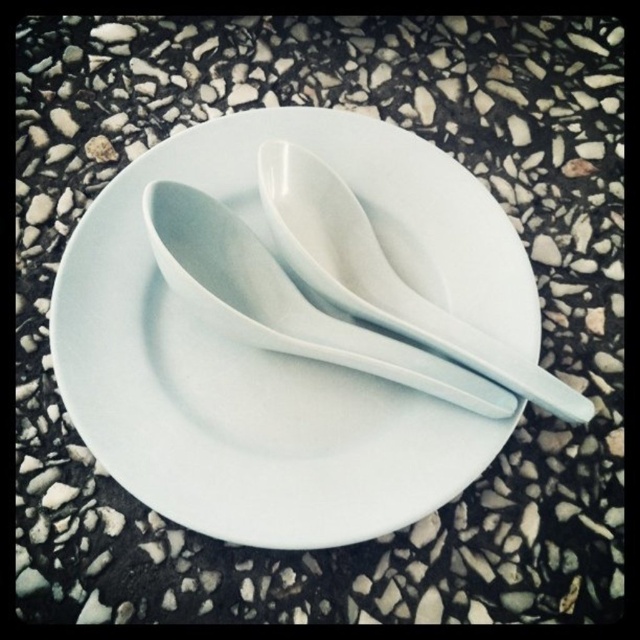
Question: Can you confirm if white ceramic saucer at center is positioned to the right of white glossy spoon at center?

Choices:
 (A) yes
 (B) no

Answer: (B)

Question: Which point appears closest to the camera in this image?

Choices:
 (A) (124, 204)
 (B) (364, 269)

Answer: (B)

Question: Is white ceramic saucer at center further to the viewer compared to white glossy spoon at center?

Choices:
 (A) no
 (B) yes

Answer: (A)

Question: Can you confirm if white ceramic saucer at center is smaller than white glossy spoon at center?

Choices:
 (A) no
 (B) yes

Answer: (A)

Question: Among these objects, which one is farthest from the camera?

Choices:
 (A) white ceramic saucer at center
 (B) white glossy spoon at center

Answer: (B)